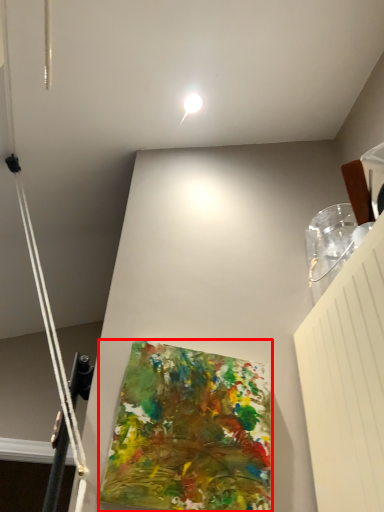
Question: From the image's perspective, considering the relative positions of art (annotated by the red box) and droplight in the image provided, where is art (annotated by the red box) located with respect to the staircase?

Choices:
 (A) above
 (B) below

Answer: (B)